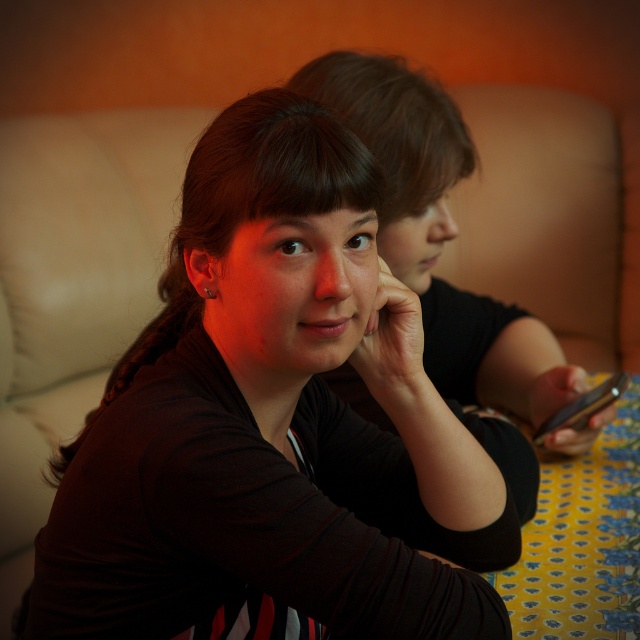
Is matte black shirt at center closer to camera compared to black glossy smartphone at right?

Yes.

Is point (305, 157) positioned behind point (612, 374)?

No, (305, 157) is closer to viewer.

This screenshot has width=640, height=640. In order to click on matte black shirt at center in this screenshot , I will do `click(273, 424)`.